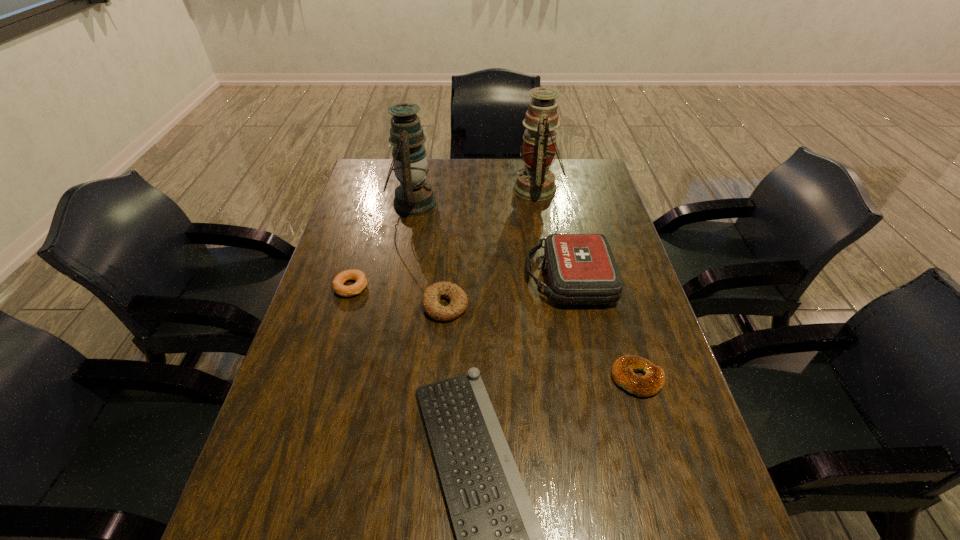
Locate an element on the screen. The height and width of the screenshot is (540, 960). free space between the right oil lamp and the left oil lamp is located at coordinates (475, 196).

Identify which object is the fourth nearest to the left oil lamp. Please provide its 2D coordinates. Your answer should be formatted as a tuple, i.e. [(x, y)], where the tuple contains the x and y coordinates of a point satisfying the conditions above.

[(581, 268)]

Identify which object is the sixth nearest to the leftmost bagel. Please provide its 2D coordinates. Your answer should be formatted as a tuple, i.e. [(x, y)], where the tuple contains the x and y coordinates of a point satisfying the conditions above.

[(623, 369)]

Choose which bagel is the second nearest neighbor to the rightmost bagel. Please provide its 2D coordinates. Your answer should be formatted as a tuple, i.e. [(x, y)], where the tuple contains the x and y coordinates of a point satisfying the conditions above.

[(361, 281)]

Image resolution: width=960 pixels, height=540 pixels. I want to click on bagel that is the second closest to the computer keyboard, so click(x=623, y=369).